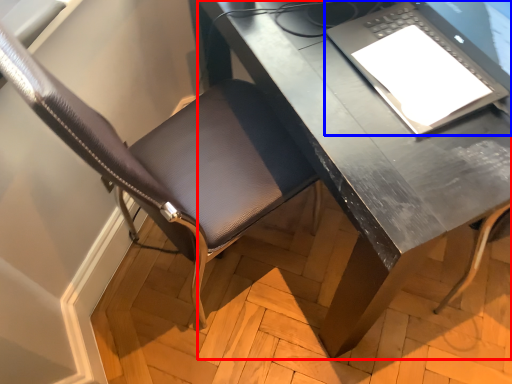
Question: Which object is further to the camera taking this photo, desk (highlighted by a red box) or laptop (highlighted by a blue box)?

Choices:
 (A) desk
 (B) laptop

Answer: (A)